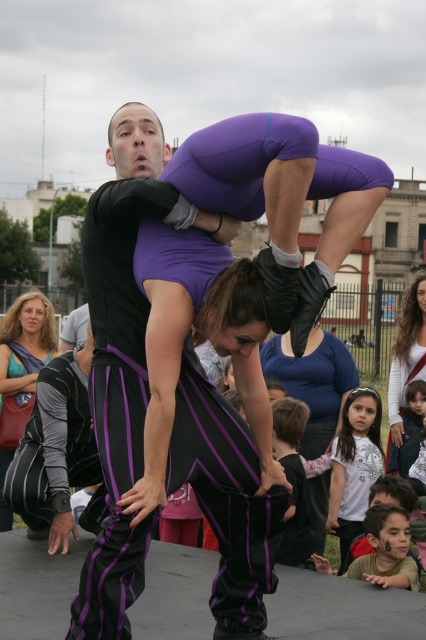
Who is more forward, (135,332) or (34,362)?

Point (135,332) is more forward.

Image resolution: width=426 pixels, height=640 pixels. Identify the location of matte black pants at center. (120, 362).

Can you confirm if matte black pants at center is bigger than matte black pants at lower left?

Indeed, matte black pants at center has a larger size compared to matte black pants at lower left.

Is matte black pants at center above matte black pants at lower left?

Yes.

This screenshot has width=426, height=640. What are the coordinates of `matte black pants at center` in the screenshot? It's located at (120, 362).

Describe the element at coordinates (25, 346) in the screenshot. This screenshot has width=426, height=640. I see `matte purple pants at center` at that location.

Based on the photo, between matte purple pants at center and white cotton shirt at center, which one is positioned lower?

matte purple pants at center is lower down.

Identify the location of matte purple pants at center. The width and height of the screenshot is (426, 640). (25, 346).

This screenshot has width=426, height=640. Find the location of `matte purple pants at center`. matte purple pants at center is located at coordinates (25, 346).